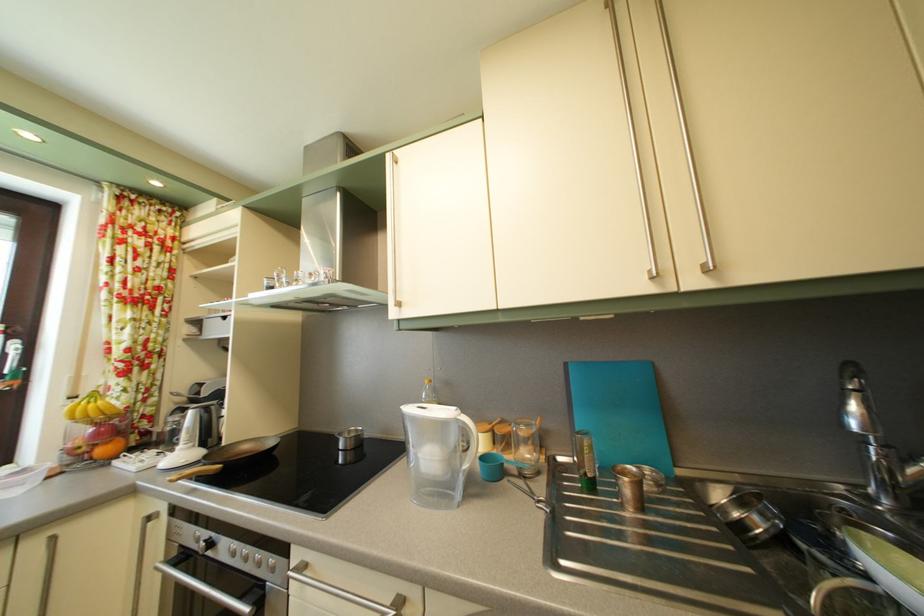
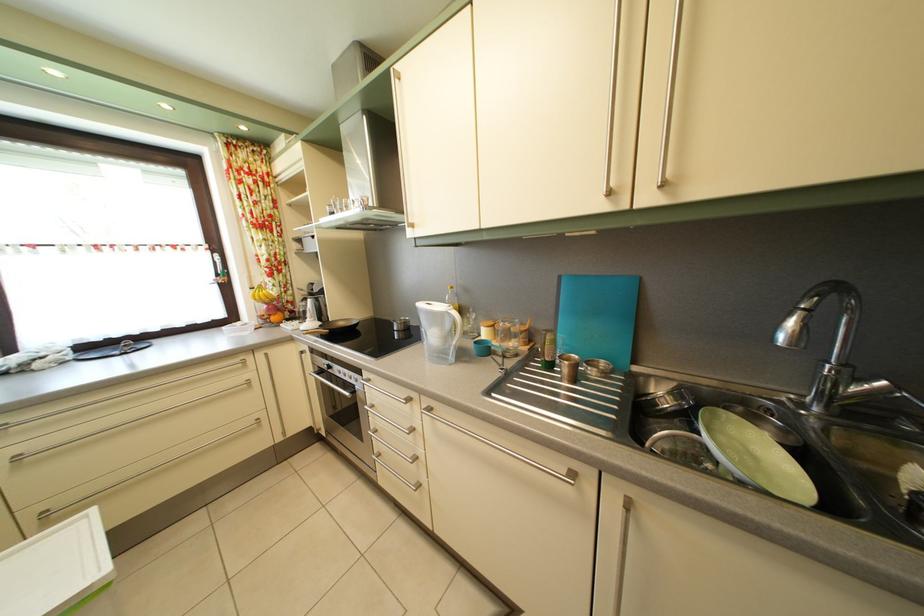
In the second image, find the point that corresponds to [375,443] in the first image.

(420, 331)